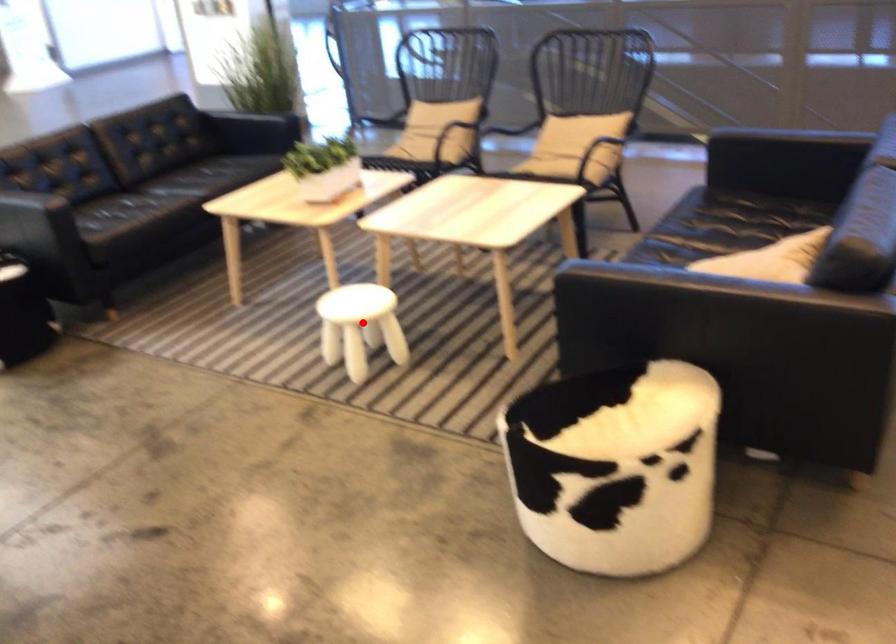
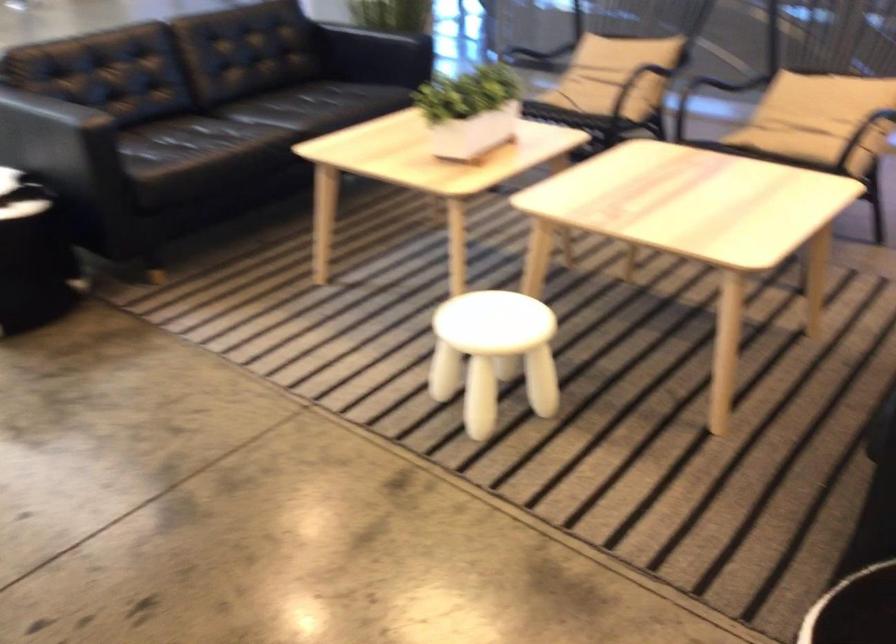
Question: I am providing you with two images of the same scene from different viewpoints. A red point is marked on the first image. Can you still see the location of the red point in image 2?

Choices:
 (A) Yes
 (B) No

Answer: (A)